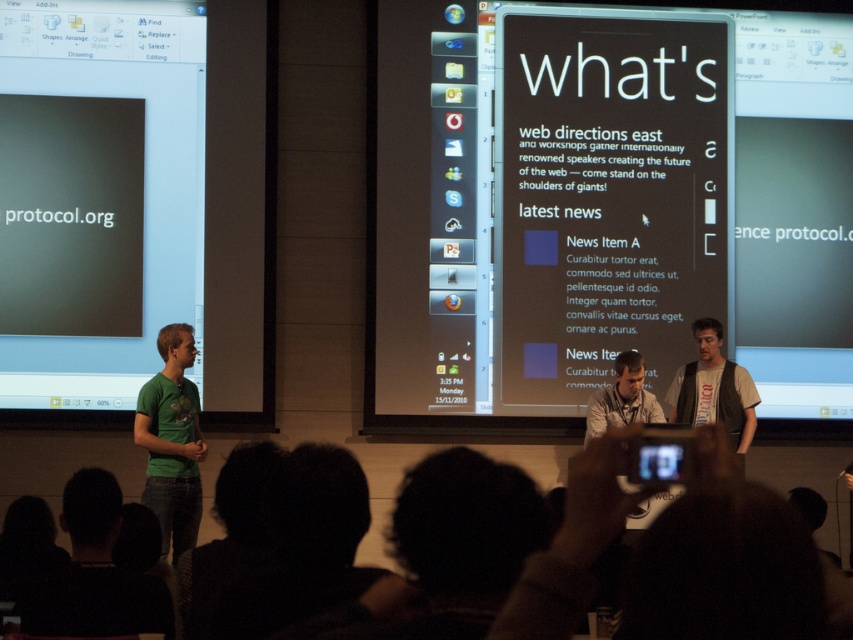
Is black fabric at lower left in front of matte white shirt at center?

Yes.

Is point (59, 572) behind point (590, 401)?

No, it is not.

Where is `black fabric at lower left`? Image resolution: width=853 pixels, height=640 pixels. black fabric at lower left is located at coordinates 96,572.

Does black fabric at lower left appear on the right side of white t-shirt at center?

Incorrect, black fabric at lower left is not on the right side of white t-shirt at center.

Between black fabric at lower left and white t-shirt at center, which one has less height?

black fabric at lower left

This screenshot has height=640, width=853. What are the coordinates of `black fabric at lower left` in the screenshot? It's located at (96, 572).

Between black glossy screen at center and matte white shirt at center, which one appears on the right side from the viewer's perspective?

From the viewer's perspective, matte white shirt at center appears more on the right side.

Which is above, black glossy screen at center or matte white shirt at center?

black glossy screen at center is above.

Is point (601, 371) positioned after point (631, 392)?

Yes, it is behind point (631, 392).

Locate an element on the screen. black glossy screen at center is located at coordinates [604, 205].